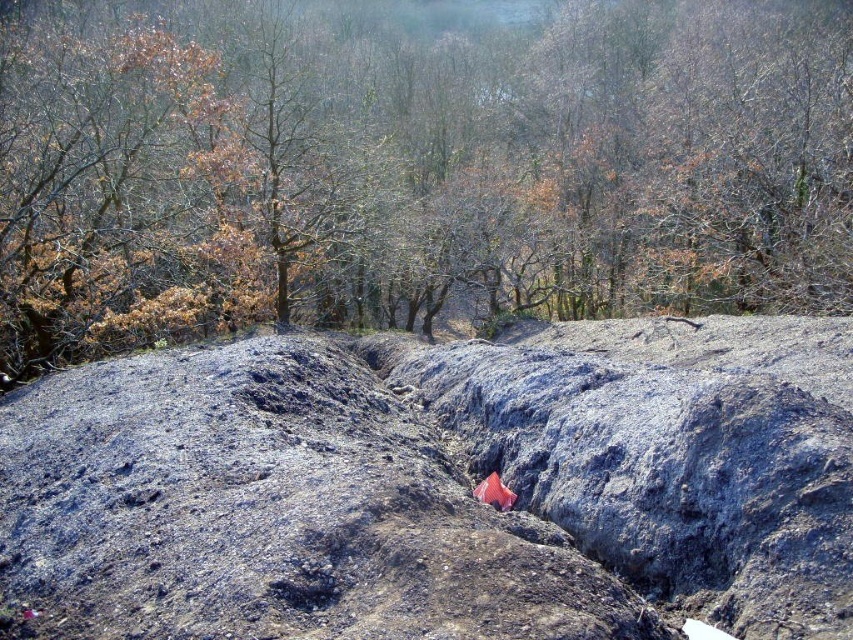
Is brown leafy tree at upper center below dull gray rock at center?

Incorrect, brown leafy tree at upper center is not positioned below dull gray rock at center.

Is brown leafy tree at upper center positioned in front of dull gray rock at center?

No, it is not.

The image size is (853, 640). What do you see at coordinates (413, 168) in the screenshot?
I see `brown leafy tree at upper center` at bounding box center [413, 168].

The width and height of the screenshot is (853, 640). I want to click on brown leafy tree at upper center, so click(413, 168).